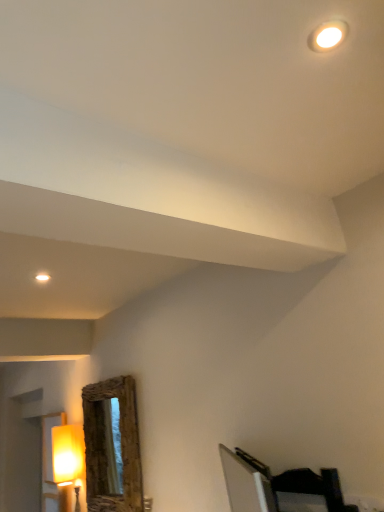
Question: Can you confirm if rustic wood mirror at lower left is positioned to the right of dark wood bed at lower right?

Choices:
 (A) no
 (B) yes

Answer: (A)

Question: Does rustic wood mirror at lower left have a lesser height compared to dark wood bed at lower right?

Choices:
 (A) no
 (B) yes

Answer: (A)

Question: Can you confirm if rustic wood mirror at lower left is smaller than dark wood bed at lower right?

Choices:
 (A) no
 (B) yes

Answer: (A)

Question: Is dark wood bed at lower right surrounded by rustic wood mirror at lower left?

Choices:
 (A) no
 (B) yes

Answer: (A)

Question: Is the position of rustic wood mirror at lower left more distant than that of dark wood bed at lower right?

Choices:
 (A) no
 (B) yes

Answer: (B)

Question: Is rustic wood mirror at lower left facing towards dark wood bed at lower right?

Choices:
 (A) no
 (B) yes

Answer: (A)

Question: Is matte yellow lampshade at left further to the viewer compared to rustic wood mirror at lower left?

Choices:
 (A) no
 (B) yes

Answer: (B)

Question: Would you consider matte yellow lampshade at left to be distant from rustic wood mirror at lower left?

Choices:
 (A) yes
 (B) no

Answer: (B)

Question: Could you tell me if matte yellow lampshade at left is turned towards rustic wood mirror at lower left?

Choices:
 (A) yes
 (B) no

Answer: (B)

Question: Is matte yellow lampshade at left not inside rustic wood mirror at lower left?

Choices:
 (A) no
 (B) yes

Answer: (B)

Question: Considering the relative positions of matte yellow lampshade at left and rustic wood mirror at lower left in the image provided, is matte yellow lampshade at left in front of rustic wood mirror at lower left?

Choices:
 (A) no
 (B) yes

Answer: (A)

Question: From the image's perspective, would you say matte yellow lampshade at left is shown under rustic wood mirror at lower left?

Choices:
 (A) yes
 (B) no

Answer: (A)

Question: Is dark wood bed at lower right to the left of matte yellow lampshade at left from the viewer's perspective?

Choices:
 (A) no
 (B) yes

Answer: (A)